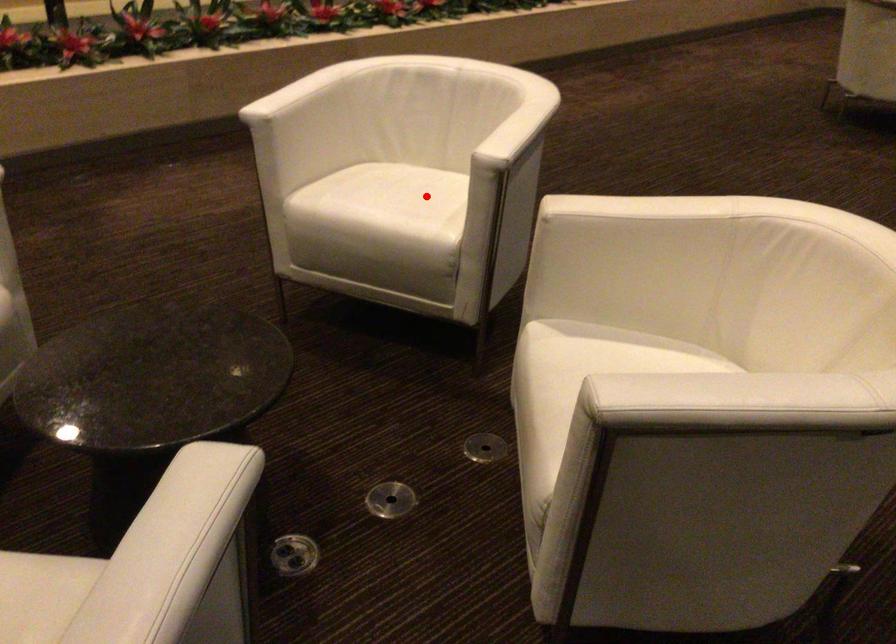
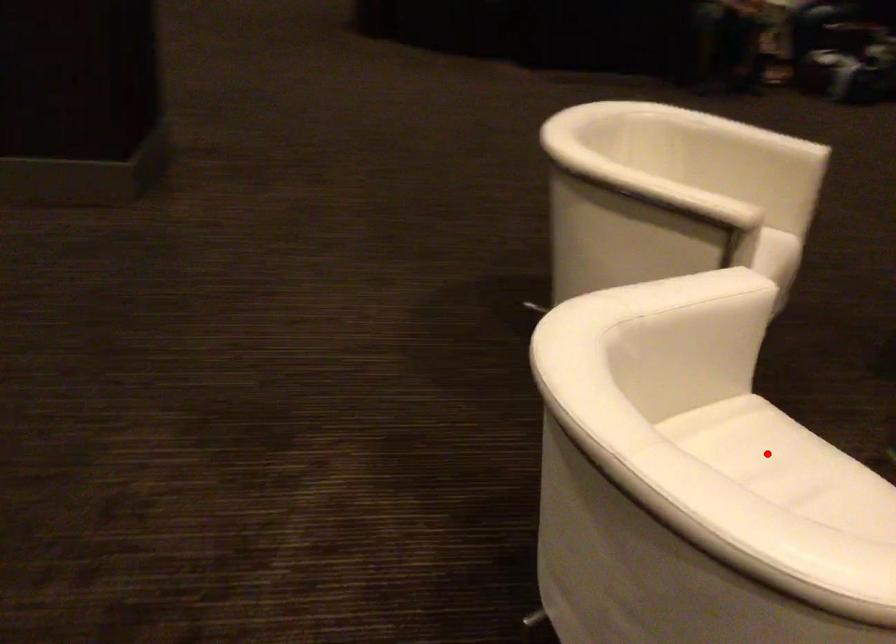
I am providing you with two images of the same scene from different viewpoints. A red point is marked on the first image and another point is marked on the second image. Is the red point in image1 aligned with the point shown in image2?

Yes